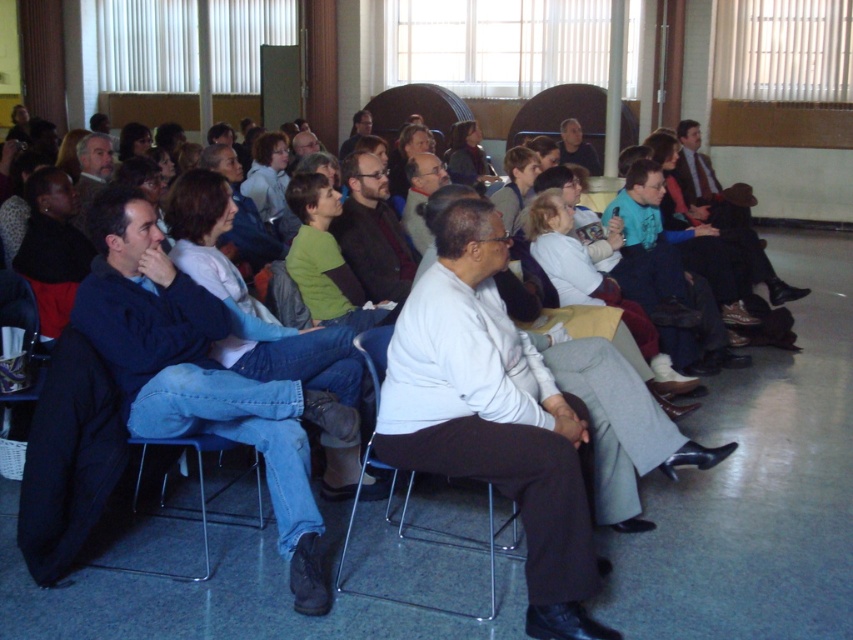
You are standing at the entrance of the hall and see the point marked at coordinates (492, 422). What object is located at that point?

The point at coordinates (492, 422) corresponds to the white matte shirt at center.

Looking at this image, you are organizing a photo shoot in this hall and need to ensure that the white matte shirt at center and the matte black jacket at upper center are visible in the frame. Given their sizes, which one might require more space in the composition?

The white matte shirt at center requires more space in the composition because its width is larger than the matte black jacket at upper center.